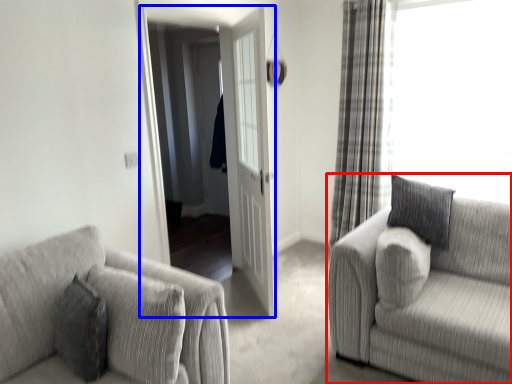
Question: Which object appears farthest to the camera in this image, studio couch (highlighted by a red box) or screen door (highlighted by a blue box)?

Choices:
 (A) studio couch
 (B) screen door

Answer: (B)